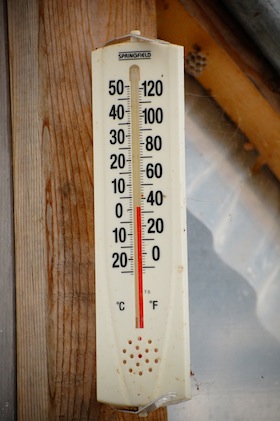
You are a GUI agent. You are given a task and a screenshot of the screen. Output one action in this format:
    pyautogui.click(x=<x>, y=<y>)
    Task: Click on the cobwebs
    This screenshot has height=421, width=280.
    Given the screenshot: What is the action you would take?
    pyautogui.click(x=205, y=98), pyautogui.click(x=220, y=111), pyautogui.click(x=234, y=135), pyautogui.click(x=214, y=129), pyautogui.click(x=238, y=150)